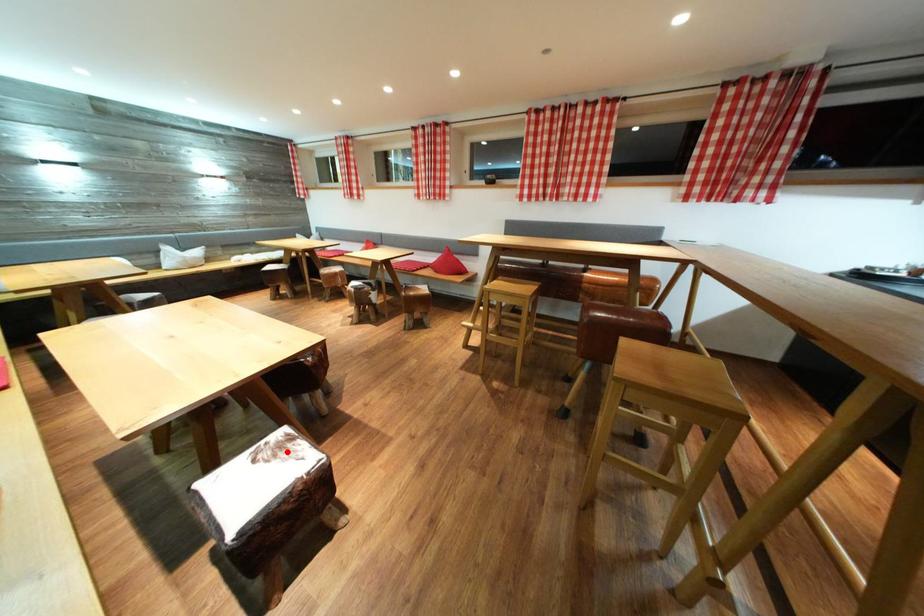
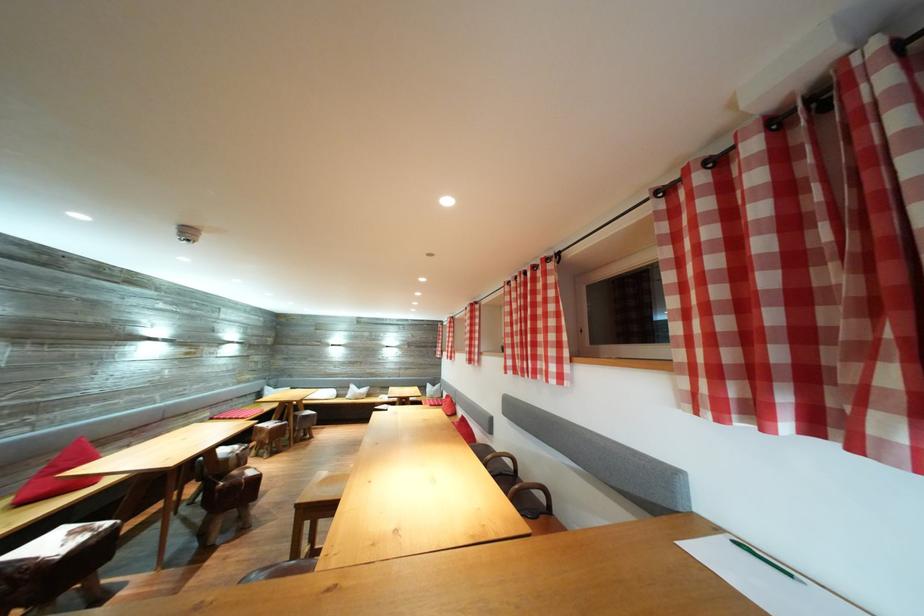
Locate, in the second image, the point that corresponds to the highlighted location in the first image.

(91, 536)